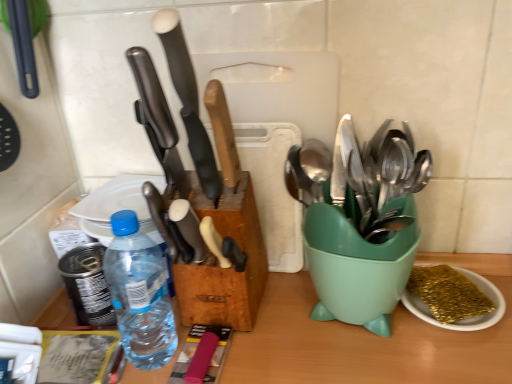
Question: Does green plastic spoon holder at right have a greater width compared to polished black knife at center, acting as the third kitchen knife starting from the right?

Choices:
 (A) no
 (B) yes

Answer: (B)

Question: Is green plastic spoon holder at right at the left side of polished black knife at center, acting as the third kitchen knife starting from the right?

Choices:
 (A) no
 (B) yes

Answer: (A)

Question: Is green plastic spoon holder at right taller than polished black knife at center, acting as the third kitchen knife starting from the right?

Choices:
 (A) yes
 (B) no

Answer: (A)

Question: Is green plastic spoon holder at right shorter than polished black knife at center, the first kitchen knife viewed from the left?

Choices:
 (A) no
 (B) yes

Answer: (A)

Question: Considering the relative sizes of green plastic spoon holder at right and polished black knife at center, the first kitchen knife viewed from the left, in the image provided, is green plastic spoon holder at right bigger than polished black knife at center, the first kitchen knife viewed from the left,?

Choices:
 (A) yes
 (B) no

Answer: (A)

Question: Is green plastic spoon holder at right not inside polished black knife at center, acting as the third kitchen knife starting from the right?

Choices:
 (A) yes
 (B) no

Answer: (A)

Question: Is polished black knife at center, acting as the third kitchen knife starting from the right, wider than white plastic plate at upper left?

Choices:
 (A) yes
 (B) no

Answer: (B)

Question: Is polished black knife at center, the first kitchen knife viewed from the left, further to camera compared to white plastic plate at upper left?

Choices:
 (A) yes
 (B) no

Answer: (B)

Question: Would you say polished black knife at center, the first kitchen knife viewed from the left, contains white plastic plate at upper left?

Choices:
 (A) no
 (B) yes

Answer: (A)

Question: Is polished black knife at center, the first kitchen knife viewed from the left, oriented towards white plastic plate at upper left?

Choices:
 (A) yes
 (B) no

Answer: (B)

Question: From a real-world perspective, is polished black knife at center, acting as the third kitchen knife starting from the right, positioned under white plastic plate at upper left based on gravity?

Choices:
 (A) no
 (B) yes

Answer: (A)

Question: From the image's perspective, is polished black knife at center, acting as the third kitchen knife starting from the right, located beneath white plastic plate at upper left?

Choices:
 (A) yes
 (B) no

Answer: (B)

Question: From a real-world perspective, does polished black knife at center, acting as the third kitchen knife starting from the right, stand above matte black knife at center, which is the 2th kitchen knife from right to left?

Choices:
 (A) no
 (B) yes

Answer: (A)